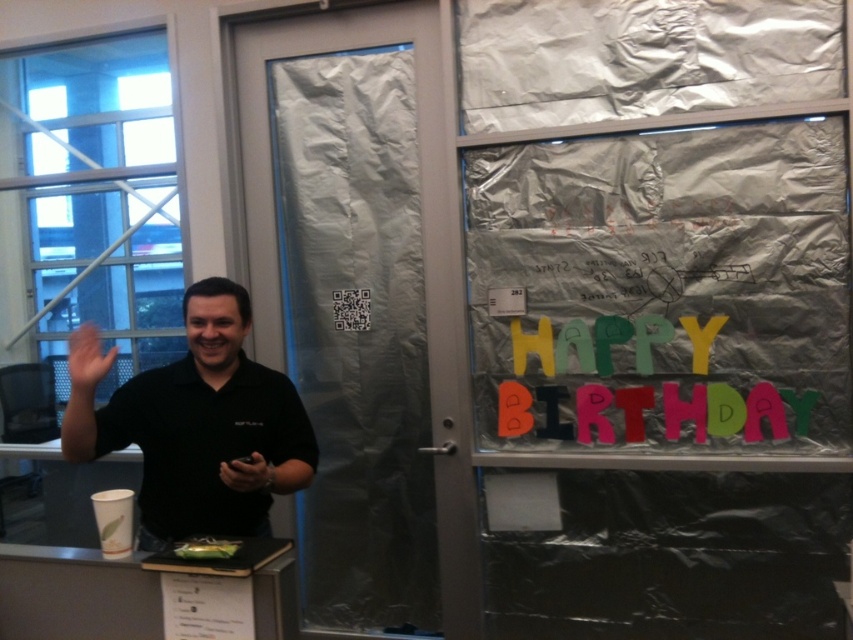
You are organizing a surprise birthday party in an office. You have a matte black phone at center and a green matte cake at center. Where should you place the cake so it is visible to guests entering the room?

The green matte cake at center should be placed below the matte black phone at center since the phone is currently above it, allowing the cake to be in a more prominent and visible position for guests entering the room.